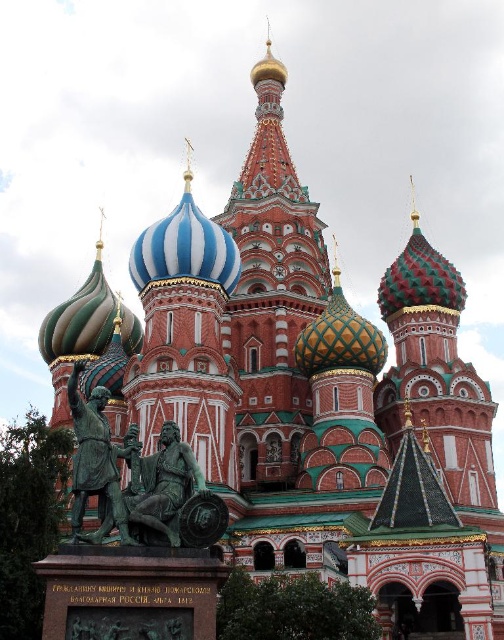
You are standing at the base of the statue in front of Saint Basil Cathedral. You see two points marked on the ground. One is at point coordinate (x=143, y=230) and the other is at point coordinate (x=91, y=472). If you want to walk towards the point that is closer to the camera, which point should you walk towards?

You should walk towards point coordinate (x=91, y=472) because it is closer to the camera compared to point coordinate (x=143, y=230).

You are a tour guide explaining the landmarks in the image to a group of tourists. You mention both the green patinated bronze statue at lower left and the blue striped dome at center. Which one is shorter in height?

The green patinated bronze statue at lower left is shorter in height compared to the blue striped dome at center.